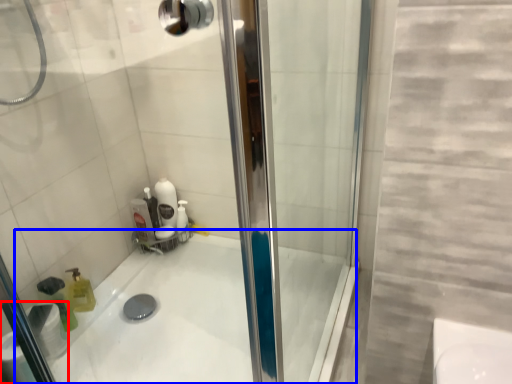
Question: Which object appears farthest to the camera in this image, toilet paper (highlighted by a red box) or bath (highlighted by a blue box)?

Choices:
 (A) toilet paper
 (B) bath

Answer: (A)